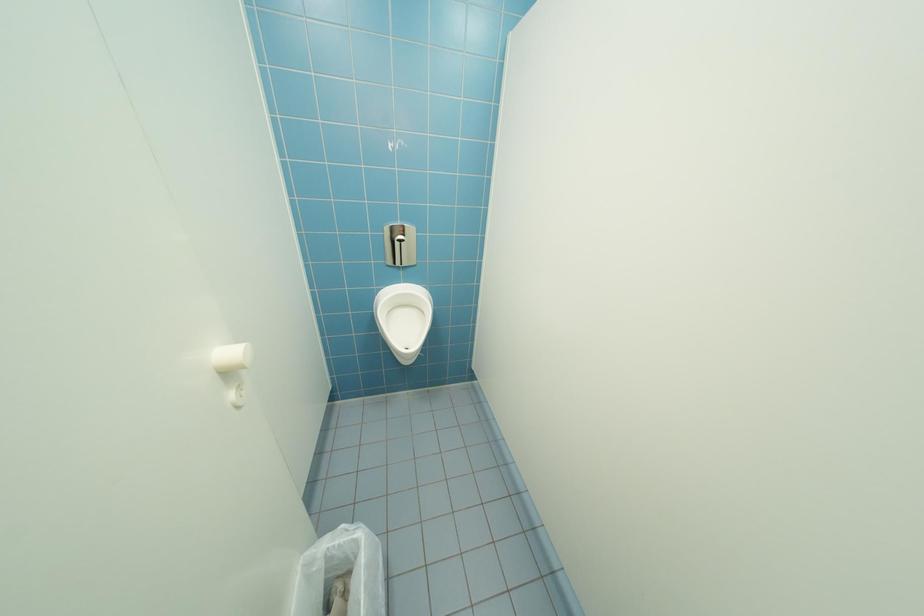
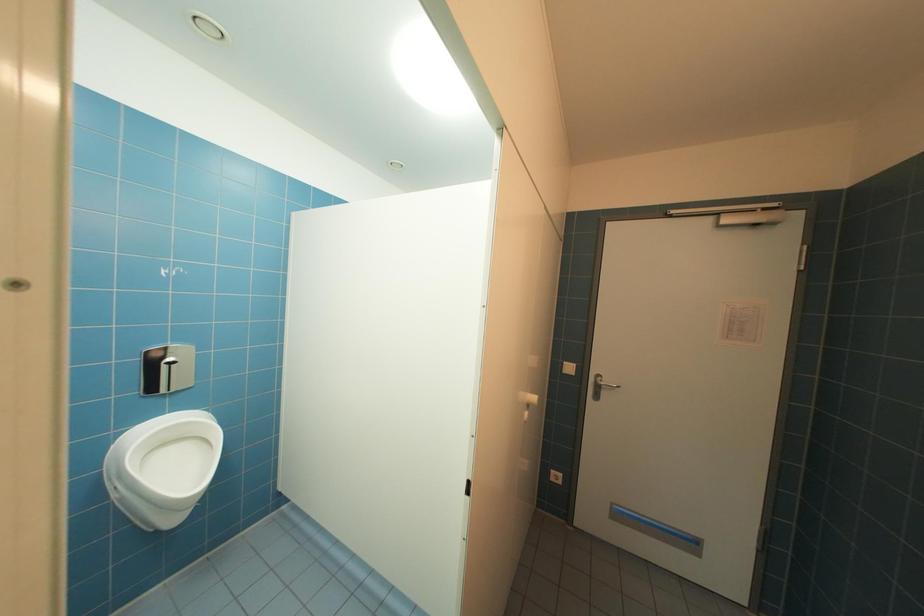
Question: How did the camera likely rotate?

Choices:
 (A) Left
 (B) Right
 (C) Up
 (D) Down

Answer: (B)